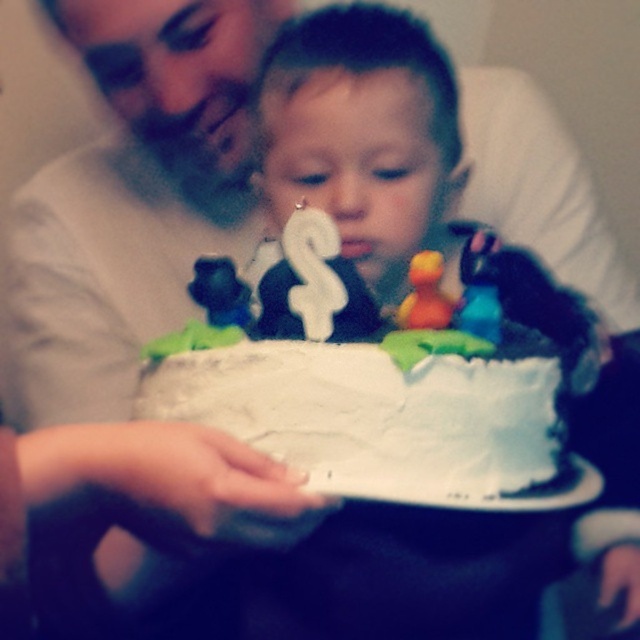
Question: Which object is positioned farthest from the orange rubber duck at center?

Choices:
 (A) white frosted cake at center
 (B) white matte candle at center
 (C) white smooth frosting at center

Answer: (B)

Question: Does matte white shirt at upper left have a greater width compared to white frosted cake at center?

Choices:
 (A) no
 (B) yes

Answer: (B)

Question: Is matte white shirt at upper left positioned at the back of orange rubber duck at center?

Choices:
 (A) no
 (B) yes

Answer: (B)

Question: Which of the following is the farthest from the observer?

Choices:
 (A) (461, 499)
 (B) (292, 172)
 (C) (413, 259)
 (D) (547, 508)

Answer: (B)

Question: Which object appears farthest from the camera in this image?

Choices:
 (A) white smooth frosting at center
 (B) orange rubber duck at center

Answer: (B)

Question: Does white smooth frosting at center have a lesser width compared to orange rubber duck at center?

Choices:
 (A) no
 (B) yes

Answer: (A)